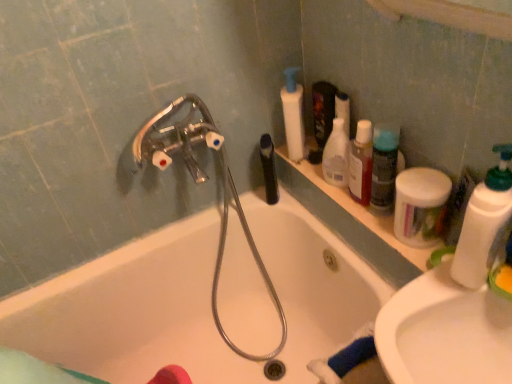
Question: Is white ceramic bathtub at center inside the boundaries of white glossy sink at lower right, or outside?

Choices:
 (A) inside
 (B) outside

Answer: (B)

Question: Is white ceramic bathtub at center taller or shorter than white glossy sink at lower right?

Choices:
 (A) short
 (B) tall

Answer: (B)

Question: Estimate the real-world distances between objects in this image. Which object is closer to the white ceramic bathtub at center?

Choices:
 (A) metallic silver garden hose at upper left
 (B) white plastic pump bottle at upper center, which is the 5th cleaning product in front-to-back order
 (C) translucent plastic bottle at upper right, which is counted as the first mouthwash, starting from the front
 (D) translucent plastic spray bottle at upper right, which ranks as the fourth cleaning product in front-to-back order
 (E) white plastic bottles at upper right

Answer: (A)

Question: Which of these objects is positioned closest to the white plastic bottle at right, the 1th cleaning product in the front-to-back sequence?

Choices:
 (A) translucent plastic bottle at upper right, which is counted as the first mouthwash, starting from the front
 (B) translucent plastic spray bottle at upper right, which ranks as the fourth cleaning product in front-to-back order
 (C) white plastic pump bottle at upper center, which is the 5th cleaning product in front-to-back order
 (D) white matte jar at upper right, the fourth cleaning product viewed from the back
 (E) white ceramic bathtub at center

Answer: (D)